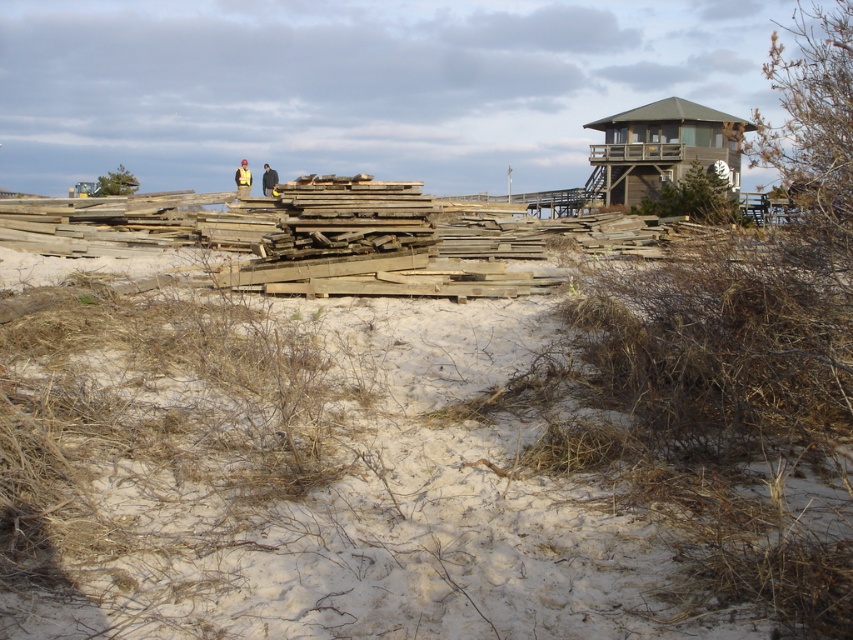
Question: Observing the image, what is the correct spatial positioning of white sandy beach at center in reference to yellow reflective vest at center?

Choices:
 (A) right
 (B) left

Answer: (A)

Question: Does white sandy beach at center have a larger size compared to yellow hard hat at center?

Choices:
 (A) no
 (B) yes

Answer: (A)

Question: Which of the following is the closest to the observer?

Choices:
 (A) yellow hard hat at center
 (B) white sandy beach at center

Answer: (B)

Question: Is the position of yellow hard hat at center more distant than that of yellow reflective vest at center?

Choices:
 (A) yes
 (B) no

Answer: (B)

Question: Which point is farther to the camera?

Choices:
 (A) yellow hard hat at center
 (B) white sandy beach at center

Answer: (A)

Question: Among these points, which one is nearest to the camera?

Choices:
 (A) pos(247,173)
 (B) pos(270,193)

Answer: (B)